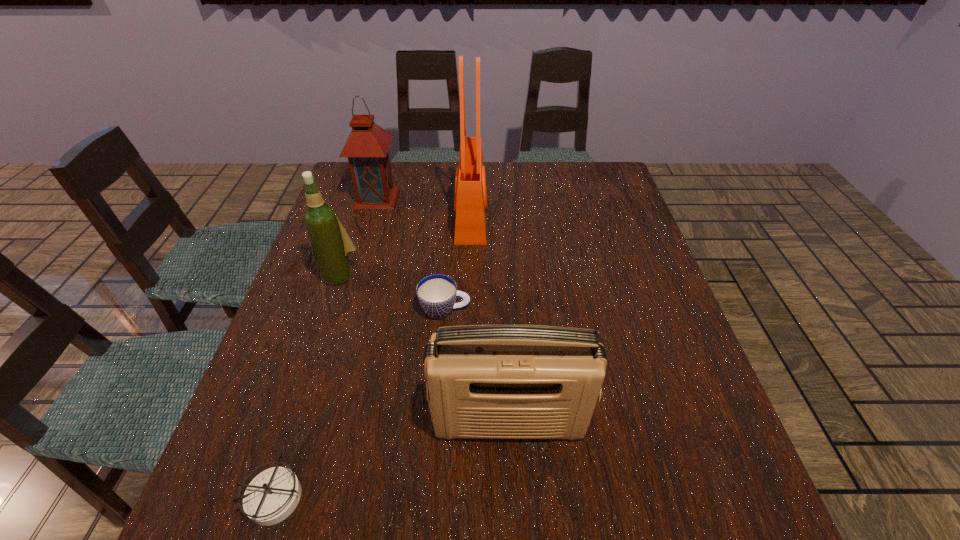
Image resolution: width=960 pixels, height=540 pixels. What are the coordinates of `vacant point located between the tallest object and the second nearest object` in the screenshot? It's located at (491, 319).

At what (x,y) coordinates should I click in order to perform the action: click on vacant point located between the cup and the lantern. Please return your answer as a coordinate pair (x, y). This screenshot has height=540, width=960. Looking at the image, I should click on (411, 253).

You are a GUI agent. You are given a task and a screenshot of the screen. Output one action in this format:
    pyautogui.click(x=<x>, y=<y>)
    Task: Click on the vacant space in between the wine bottle and the lantern
    The width and height of the screenshot is (960, 540).
    Given the screenshot: What is the action you would take?
    pyautogui.click(x=358, y=236)

Identify which object is the fourth closest to the fifth farthest object. Please provide its 2D coordinates. Your answer should be formatted as a tuple, i.e. [(x, y)], where the tuple contains the x and y coordinates of a point satisfying the conditions above.

[(470, 204)]

At what (x,y) coordinates should I click in order to perform the action: click on the closest object to the fourth farthest object. Please return your answer as a coordinate pair (x, y). The width and height of the screenshot is (960, 540). Looking at the image, I should click on (331, 245).

Find the location of `vacant position in the image that satisfies the following two spatial constraints: 1. on the side of the fourth farthest object with the handle; 2. on the front side of the shortest object`. vacant position in the image that satisfies the following two spatial constraints: 1. on the side of the fourth farthest object with the handle; 2. on the front side of the shortest object is located at coordinates (430, 496).